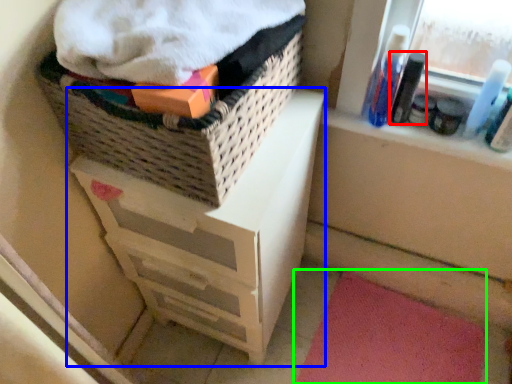
Question: Estimate the real-world distances between objects in this image. Which object is farther from mouthwash (highlighted by a red box), chest of drawers (highlighted by a blue box) or bath mat (highlighted by a green box)?

Choices:
 (A) chest of drawers
 (B) bath mat

Answer: (B)